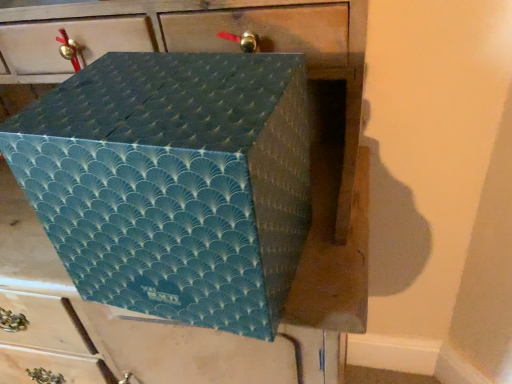
Where is `free space above teal textured box at center (from a real-world perspective)`? The image size is (512, 384). free space above teal textured box at center (from a real-world perspective) is located at coordinates (159, 87).